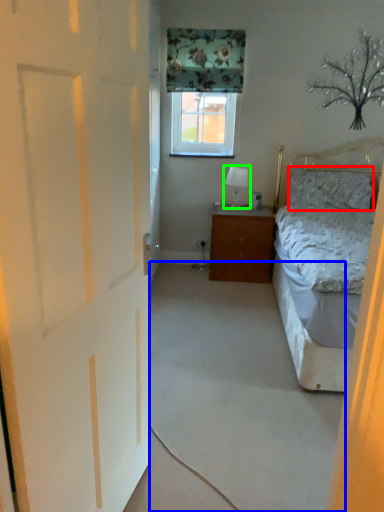
Question: Which object is positioned farthest from pillow (highlighted by a red box)? Select from plain (highlighted by a blue box) and table lamp (highlighted by a green box).

Choices:
 (A) plain
 (B) table lamp

Answer: (A)